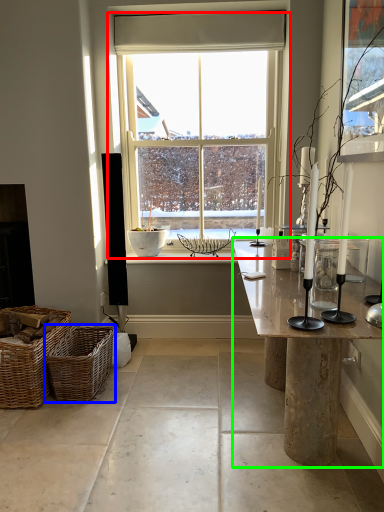
Question: Which object is positioned closest to window (highlighted by a red box)? Select from picnic basket (highlighted by a blue box) and table (highlighted by a green box).

Choices:
 (A) picnic basket
 (B) table

Answer: (A)